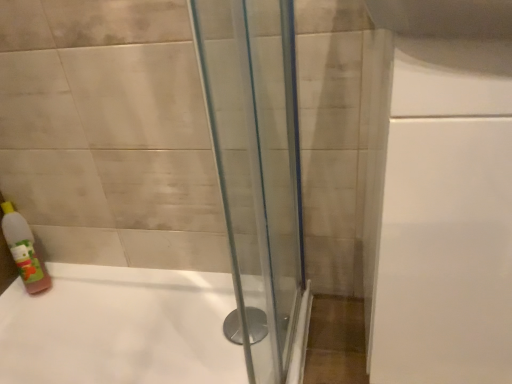
Question: Is white glossy bathtub at center inside the boundaries of translucent plastic bottle at lower left, or outside?

Choices:
 (A) inside
 (B) outside

Answer: (B)

Question: Is white glossy bathtub at center bigger or smaller than translucent plastic bottle at lower left?

Choices:
 (A) big
 (B) small

Answer: (A)

Question: In terms of width, does white glossy bathtub at center look wider or thinner when compared to translucent plastic bottle at lower left?

Choices:
 (A) thin
 (B) wide

Answer: (B)

Question: In terms of size, does translucent plastic bottle at lower left appear bigger or smaller than white glossy bathtub at center?

Choices:
 (A) big
 (B) small

Answer: (B)

Question: Does point (10, 241) appear closer or farther from the camera than point (71, 360)?

Choices:
 (A) farther
 (B) closer

Answer: (A)

Question: From the image's perspective, is translucent plastic bottle at lower left located above or below white glossy bathtub at center?

Choices:
 (A) above
 (B) below

Answer: (A)

Question: In terms of height, does translucent plastic bottle at lower left look taller or shorter compared to white glossy bathtub at center?

Choices:
 (A) short
 (B) tall

Answer: (B)